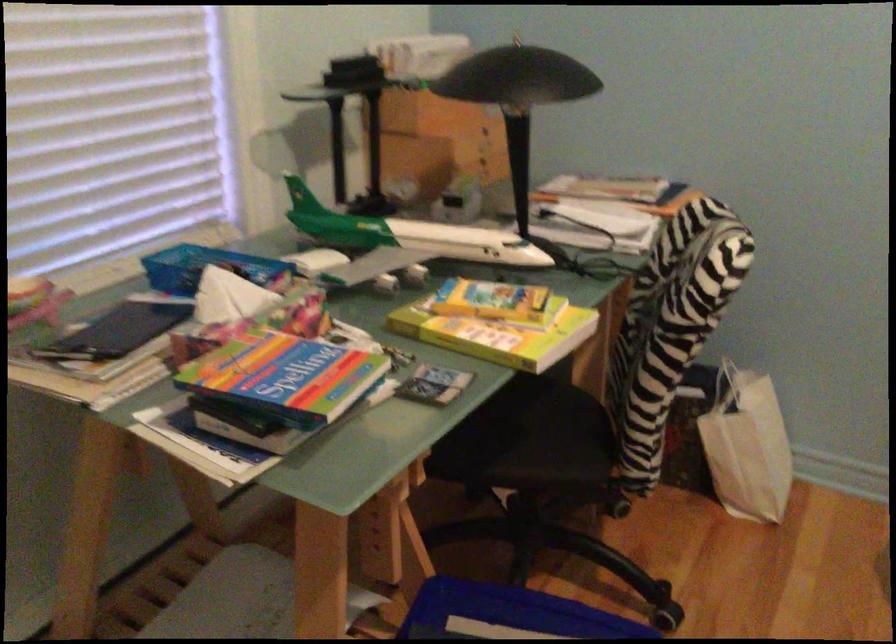
The image size is (896, 644). Find the location of `chair sitting surface`. chair sitting surface is located at coordinates (510, 430).